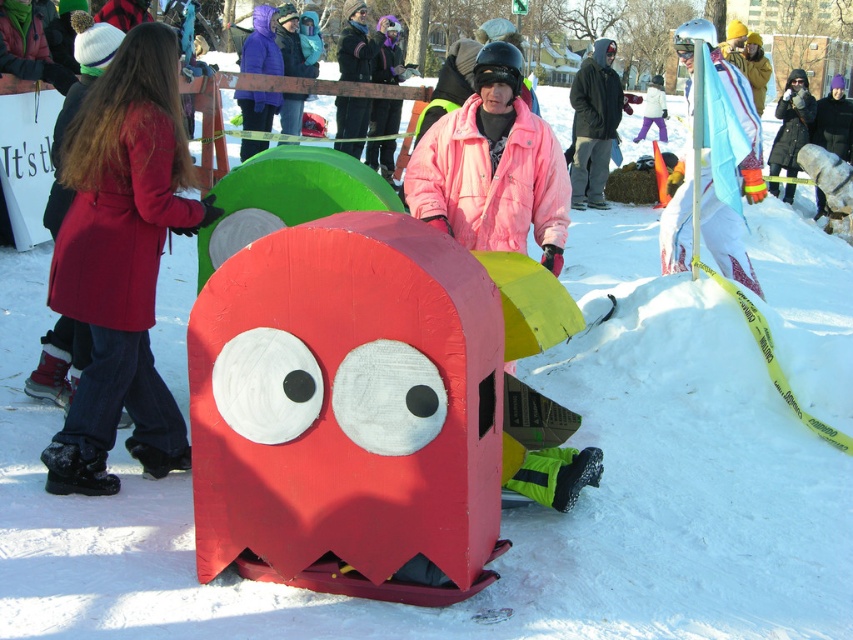
Question: Is dark gray hooded jacket at center closer to the viewer compared to purple matte jacket at upper center?

Choices:
 (A) yes
 (B) no

Answer: (B)

Question: Based on their relative distances, which object is nearer to the purple matte jacket at upper center?

Choices:
 (A) black fur coat at upper right
 (B) matte pink jacket at center
 (C) dark gray hooded jacket at center

Answer: (C)

Question: Which of the following is the closest to the observer?

Choices:
 (A) (260, 49)
 (B) (524, 451)

Answer: (B)

Question: Estimate the real-world distances between objects in this image. Which object is closer to the black fur coat at upper right?

Choices:
 (A) purple matte jacket at upper center
 (B) matte red coat at left

Answer: (A)

Question: Is matte red coat at left further to the viewer compared to matte pink jacket at center?

Choices:
 (A) yes
 (B) no

Answer: (B)

Question: From the image, what is the correct spatial relationship of purple matte jacket at upper center in relation to black fur coat at upper right?

Choices:
 (A) right
 (B) left

Answer: (B)